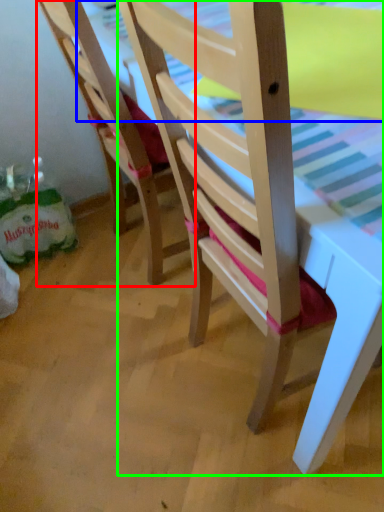
Question: Which is nearer to the chair (highlighted by a red box)? table top (highlighted by a blue box) or chair (highlighted by a green box).

Choices:
 (A) table top
 (B) chair

Answer: (A)